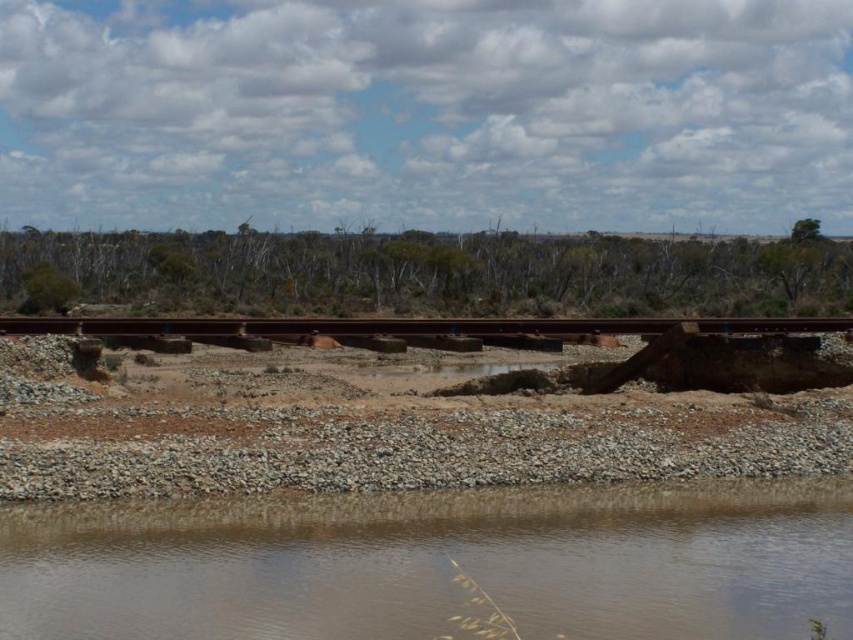
Which is behind, point (630, 252) or point (434, 321)?

Point (630, 252)

Does point (345, 241) come behind point (258, 330)?

Yes, it is.

Image resolution: width=853 pixels, height=640 pixels. I want to click on green leafy trees at center, so click(x=428, y=273).

Who is more forward, (779, 320) or (813, 227)?

Point (779, 320) is more forward.

Does brown concrete train track at center come behind green leafy tree at upper right?

No, brown concrete train track at center is in front of green leafy tree at upper right.

Does point (32, 332) come in front of point (817, 228)?

That is True.

Find the location of `brown concrete train track at center`. brown concrete train track at center is located at coordinates (410, 324).

Which is more to the right, brown sedimentary water at lower center or green leafy trees at center?

Positioned to the right is brown sedimentary water at lower center.

Does brown sedimentary water at lower center appear over green leafy trees at center?

Actually, brown sedimentary water at lower center is below green leafy trees at center.

Is point (697, 634) closer to viewer compared to point (357, 268)?

Yes, it is.

Where is `brown sedimentary water at lower center`? brown sedimentary water at lower center is located at coordinates (440, 564).